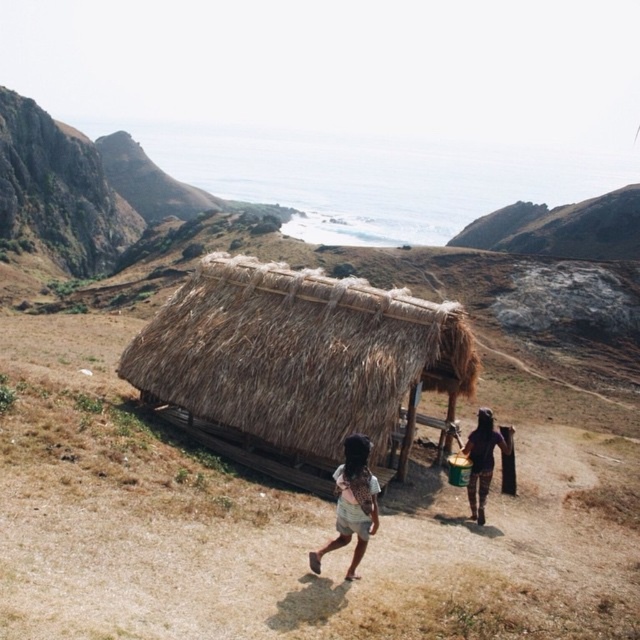
You are navigating a map of a rural area and need to locate the brown thatch hut at center. According to the coordinates provided, where exactly is the brown thath hut at center positioned?

The brown thatch hut at center is located at point (298, 365).

You are a traveler approaching the brown thatch hut at center and the light brown fabric skirt at lower center in this rural scene. Which object would appear closer to you as you walk towards them?

The light brown fabric skirt at lower center would appear closer to you because it is positioned at lower center, which is typically closer to the observer in such scenes, whereas the brown thatch hut at center is situated further back, making it appear farther away.